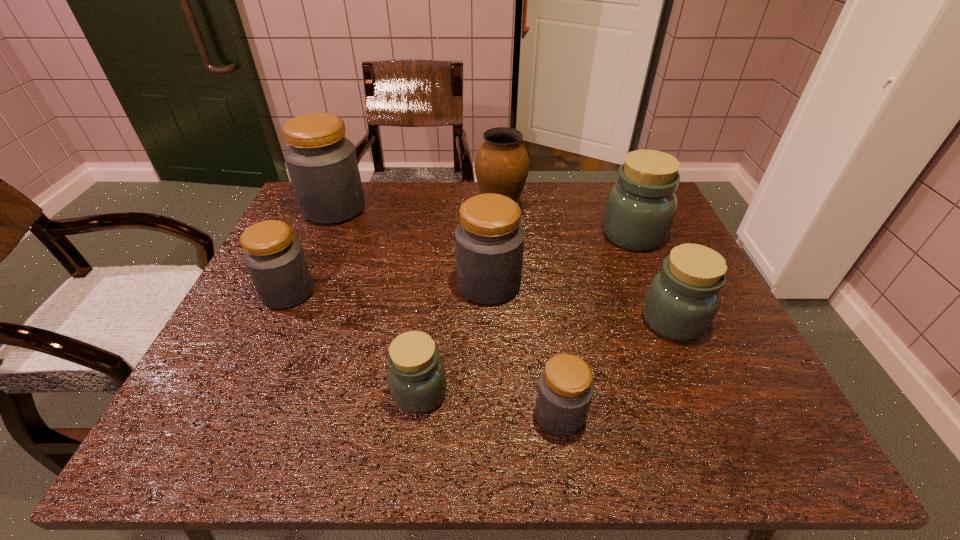
Find the location of a particular element. vacant space at the right edge is located at coordinates click(x=714, y=341).

In the image, there is a desktop. Find the location of `free space at the far left corner`. free space at the far left corner is located at coordinates (304, 225).

In the image, there is a desktop. Identify the location of vacant space at the near right corner. (774, 444).

Locate an element on the screen. This screenshot has height=540, width=960. vacant area between the brown urn and the second biggest green jar is located at coordinates (587, 266).

Identify the location of free space between the second nearest green jar and the smallest green jar. This screenshot has height=540, width=960. (546, 356).

Image resolution: width=960 pixels, height=540 pixels. I want to click on vacant space in between the third object from left to right and the brown urn, so click(x=460, y=302).

Identify the location of empty space between the farthest green jar and the smallest gray jar. (596, 325).

Where is `free spot between the nearest gray jar and the smallest green jar`? Image resolution: width=960 pixels, height=540 pixels. free spot between the nearest gray jar and the smallest green jar is located at coordinates (490, 403).

At what (x,y) coordinates should I click in order to perform the action: click on free area in between the third biggest gray jar and the brown urn. Please return your answer as a coordinate pair (x, y). Image resolution: width=960 pixels, height=540 pixels. Looking at the image, I should click on (395, 252).

Where is `free point between the fourth jar from right to left and the farthest gray jar`? The height and width of the screenshot is (540, 960). free point between the fourth jar from right to left and the farthest gray jar is located at coordinates (412, 247).